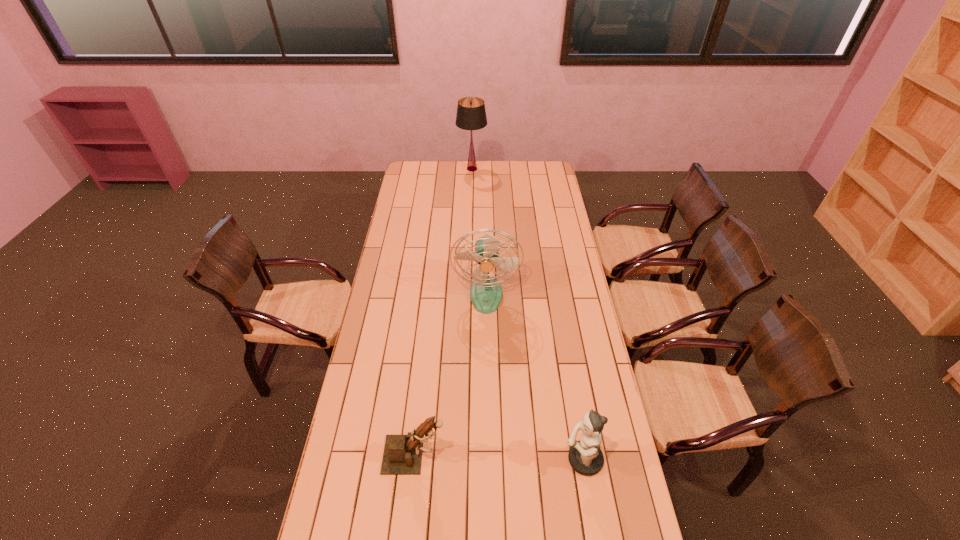
Locate an element on the screen. Image resolution: width=960 pixels, height=540 pixels. vacant region between the lampshade and the left figurine is located at coordinates pyautogui.click(x=444, y=312).

I want to click on empty location between the lampshade and the left figurine, so click(444, 312).

Choose which object is the third nearest neighbor to the fan. Please provide its 2D coordinates. Your answer should be formatted as a tuple, i.e. [(x, y)], where the tuple contains the x and y coordinates of a point satisfying the conditions above.

[(471, 115)]

Choose which object is the nearest neighbor to the farthest object. Please provide its 2D coordinates. Your answer should be formatted as a tuple, i.e. [(x, y)], where the tuple contains the x and y coordinates of a point satisfying the conditions above.

[(486, 293)]

Locate which figurine ranks second in proximity to the farthest object. Please provide its 2D coordinates. Your answer should be formatted as a tuple, i.e. [(x, y)], where the tuple contains the x and y coordinates of a point satisfying the conditions above.

[(585, 456)]

The image size is (960, 540). Identify the location of free location that satisfies the following two spatial constraints: 1. in front of the fan, directing airflow; 2. on the front-facing side of the left figurine. (489, 455).